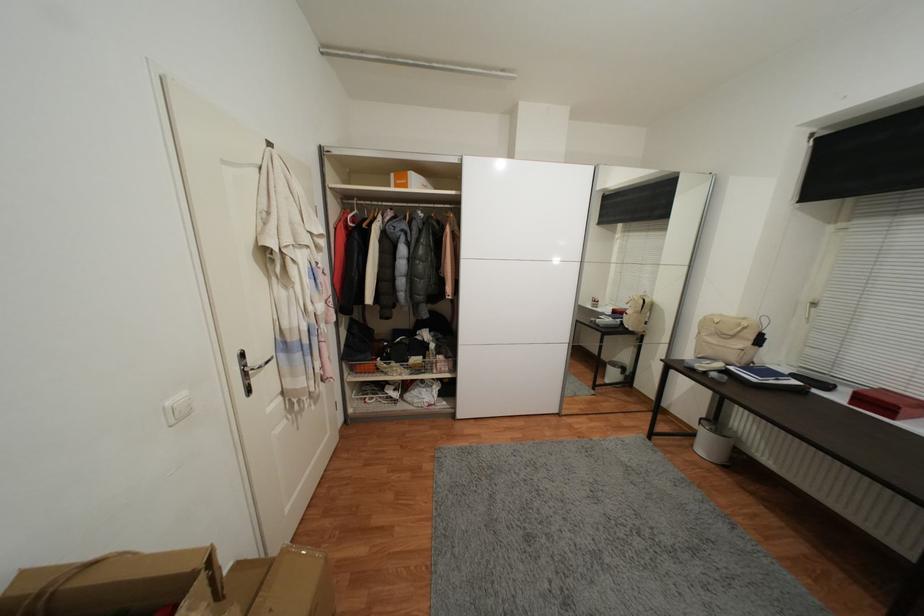
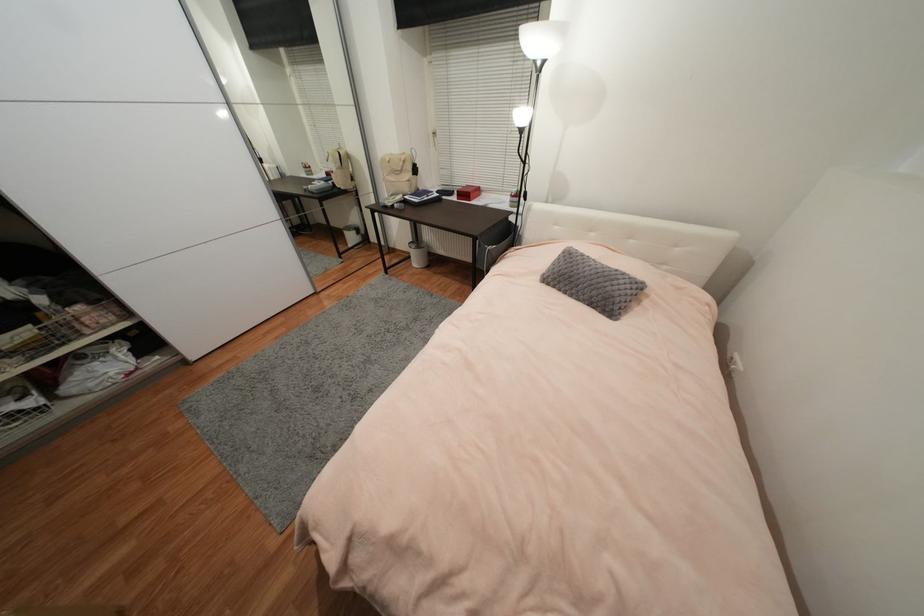
In the second image, find the point that corresponds to (x=736, y=360) in the first image.

(410, 191)